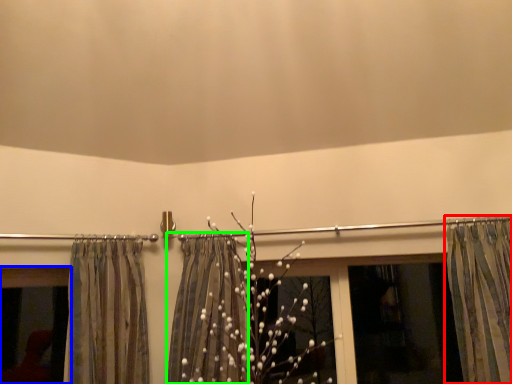
Question: Estimate the real-world distances between objects in this image. Which object is farther from curtain (highlighted by a red box), window (highlighted by a blue box) or shower curtain (highlighted by a green box)?

Choices:
 (A) window
 (B) shower curtain

Answer: (A)